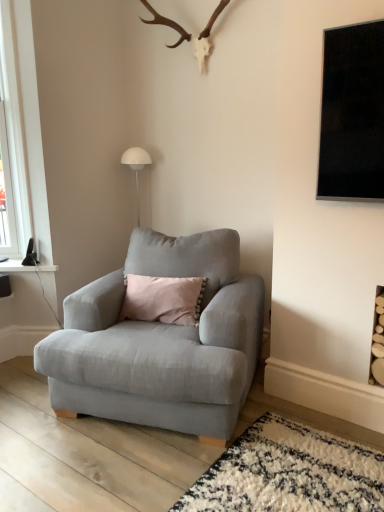
Image resolution: width=384 pixels, height=512 pixels. What do you see at coordinates (161, 341) in the screenshot?
I see `light gray fabric armchair at center` at bounding box center [161, 341].

This screenshot has width=384, height=512. In order to click on light gray fabric armchair at center in this screenshot , I will do `click(161, 341)`.

In order to click on light gray fabric armchair at center in this screenshot , I will do `click(161, 341)`.